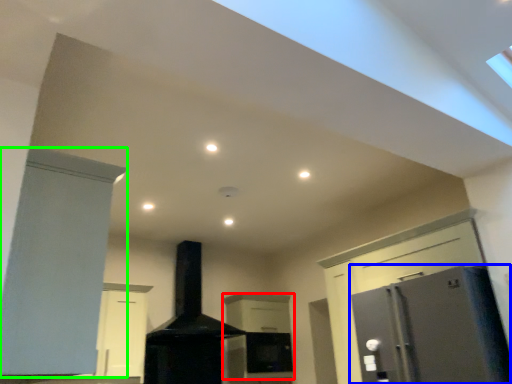
Question: Estimate the real-world distances between objects in this image. Which object is closer to cabinetry (highlighted by a red box), refrigerator (highlighted by a blue box) or cabinetry (highlighted by a green box)?

Choices:
 (A) refrigerator
 (B) cabinetry

Answer: (A)